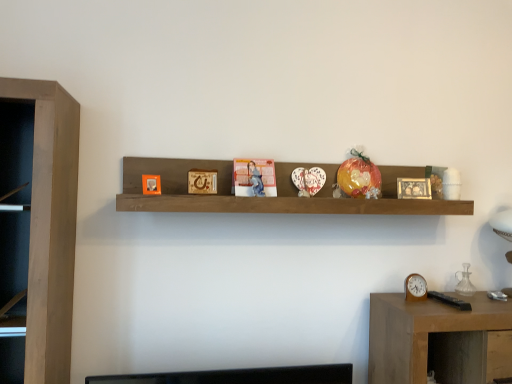
Question: Visually, is matte plastic calendar at center positioned to the left or to the right of wooden table at lower right?

Choices:
 (A) right
 (B) left

Answer: (B)

Question: From the image's perspective, is matte plastic calendar at center positioned above or below wooden table at lower right?

Choices:
 (A) above
 (B) below

Answer: (A)

Question: Which object is the closest to the matte plastic calendar at center?

Choices:
 (A) translucent plastic toy at center
 (B) wooden table at lower right
 (C) woodenmaterial/texturepicture frame at center, the second picture frame in the back-to-front sequence
 (D) orange matte picture frame at upper center, positioned as the 1th picture frame in front-to-back order
 (E) wooden shelf at center

Answer: (C)

Question: Which object is the closest to the wooden clock at right?

Choices:
 (A) wooden picture frame at center, the third picture frame positioned from the front
 (B) woodenmaterial/texturepicture frame at center, the second picture frame in the right-to-left sequence
 (C) translucent plastic toy at center
 (D) wooden shelf at center
 (E) wooden table at lower right

Answer: (E)